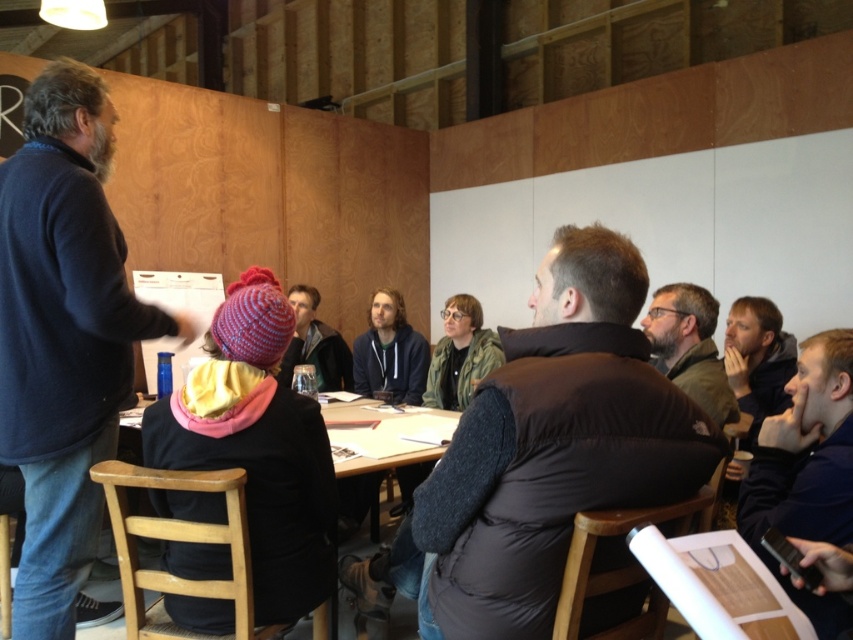
You are standing in the room and want to hand a document to the person wearing the dark blue puffer jacket at lower right and the dark blue hoodie at center. Which one is closer to you?

The dark blue puffer jacket at lower right is closer to the viewer than dark blue hoodie at center, so you should hand the document to the dark blue puffer jacket at lower right first since it is nearer.

You are a photographer trying to capture a candid shot of the dark brown puffer vest at center and the dark gray hoodie at center. Which one will appear larger in your photo?

The dark brown puffer vest at center will appear larger in the photo because it is closer to the viewer than the dark gray hoodie at center.

You are a photographer trying to capture a photo of the dark blue puffer jacket at lower right and dark blue hoodie at center. Which one should you focus on first if you want to ensure both are in the frame without moving the camera?

The dark blue puffer jacket at lower right is much taller than the dark blue hoodie at center, so you should focus on the taller one first to ensure both fit in the frame.